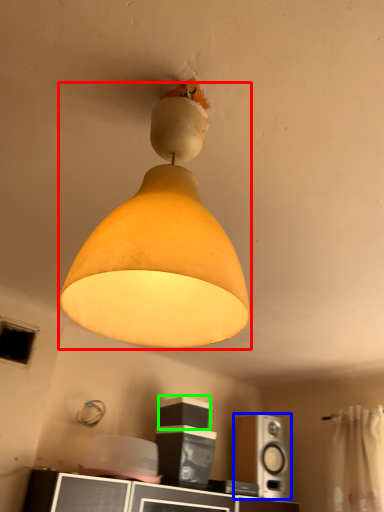
Question: Which object is positioned closest to lamp (highlighted by a red box)? Select from speaker (highlighted by a blue box) and speaker (highlighted by a green box).

Choices:
 (A) speaker
 (B) speaker

Answer: (B)